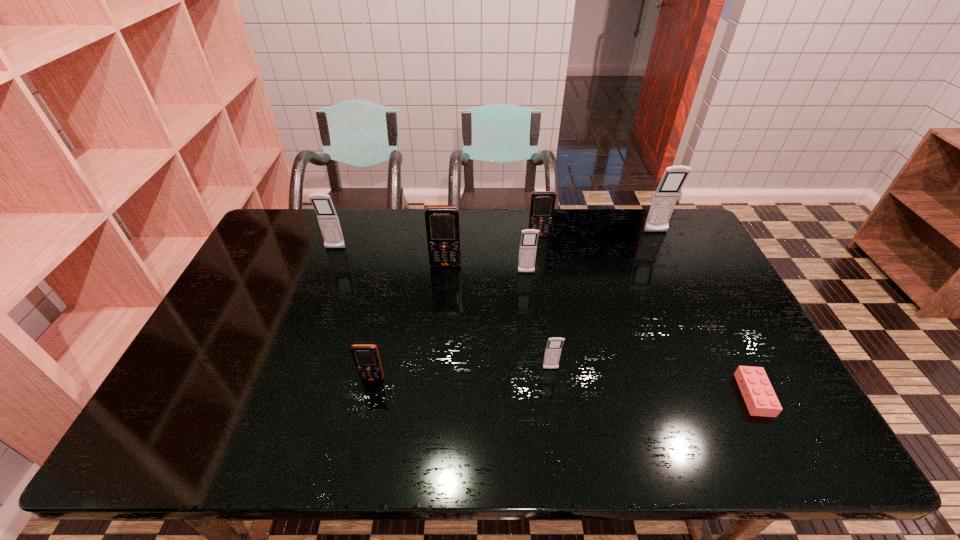
Locate an element on the screen. vacant space situated 0.320m on the screen of the second biggest orange cellular telephone is located at coordinates (550, 304).

In order to click on vacant space located on the screen of the nearest orange cellular telephone in this screenshot , I will do `click(360, 438)`.

Where is `blank space located on the front-facing side of the nearest gray cellular telephone`? blank space located on the front-facing side of the nearest gray cellular telephone is located at coordinates (559, 426).

The height and width of the screenshot is (540, 960). I want to click on vacant space situated on the back of the shortest object, so click(726, 340).

Identify the location of cellular telephone at the right edge. The width and height of the screenshot is (960, 540). (665, 197).

What are the coordinates of `Lego situated at the right edge` in the screenshot? It's located at (757, 391).

Find the location of a particular element. Image resolution: width=960 pixels, height=540 pixels. object present at the far right corner is located at coordinates (665, 197).

Where is `vacant space at the far edge`? vacant space at the far edge is located at coordinates (355, 247).

In the image, there is a desktop. Where is `vacant space at the near edge`? This screenshot has height=540, width=960. vacant space at the near edge is located at coordinates (584, 433).

The image size is (960, 540). In order to click on vacant region at the left edge of the desktop in this screenshot , I will do coord(287,281).